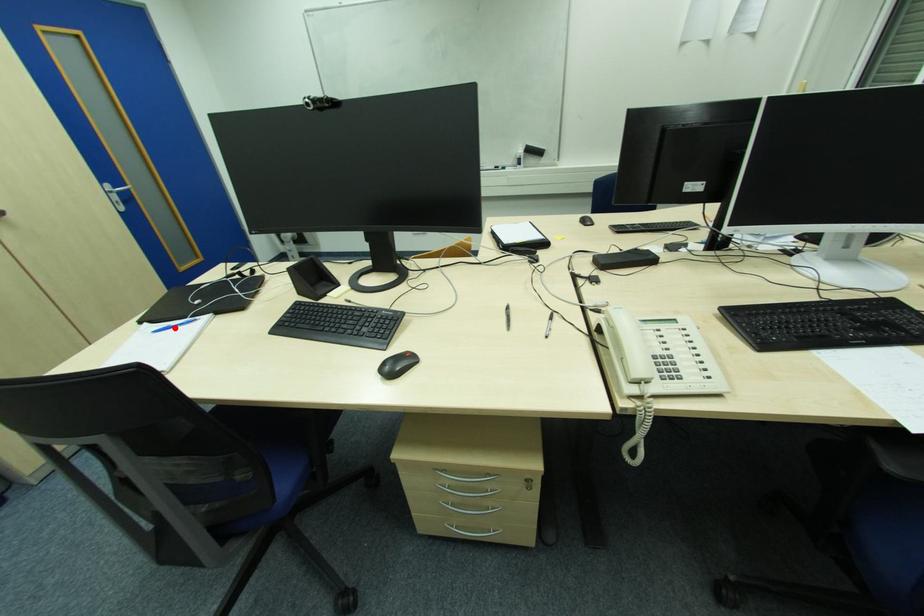
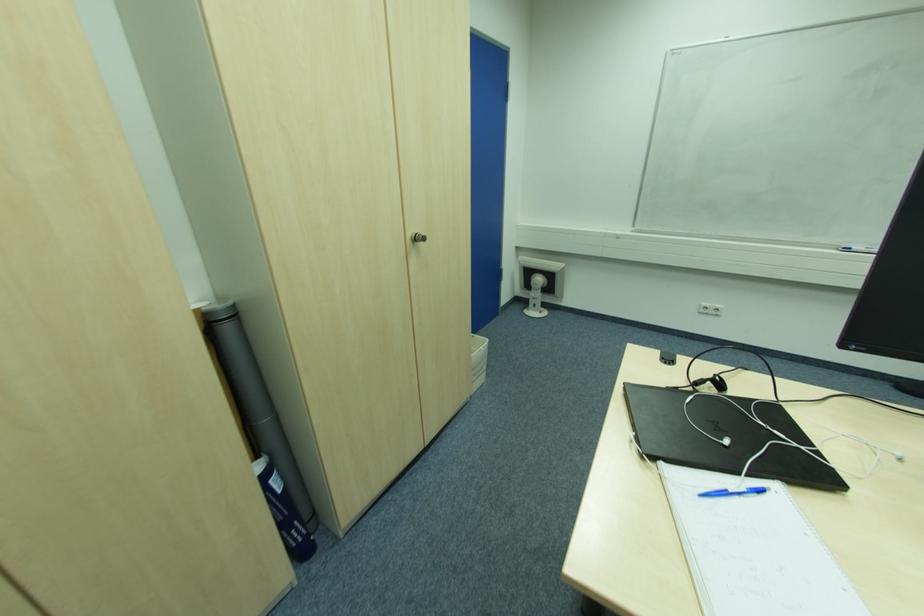
Locate, in the second image, the point that corresponds to the highlighted location in the first image.

(727, 493)